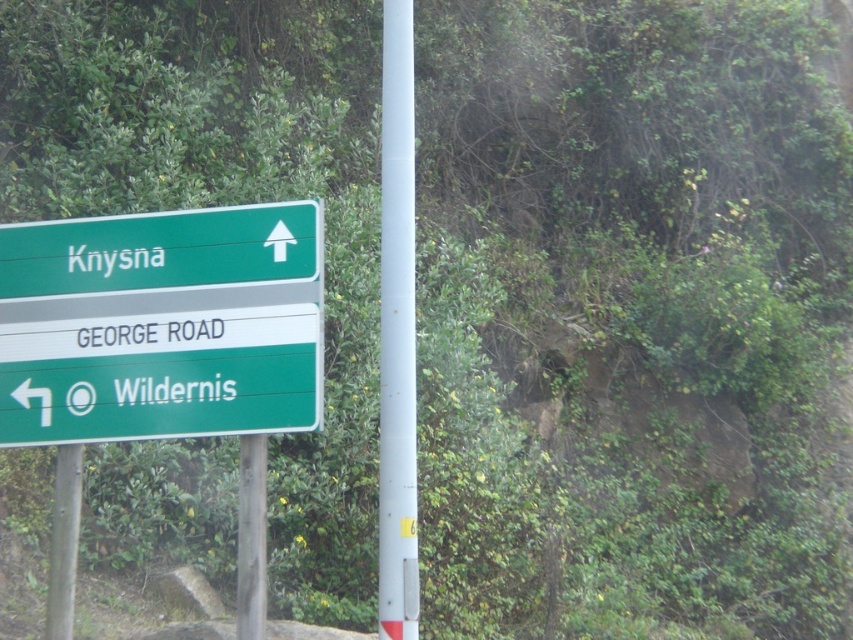
Which of these two, green plastic sign at upper center or white metallic pole at center, stands shorter?

green plastic sign at upper center

Does green plastic sign at upper center have a greater width compared to white metallic pole at center?

Yes, green plastic sign at upper center is wider than white metallic pole at center.

The width and height of the screenshot is (853, 640). What do you see at coordinates (161, 250) in the screenshot? I see `green plastic sign at upper center` at bounding box center [161, 250].

I want to click on green plastic sign at upper center, so click(161, 250).

Who is positioned more to the right, white metallic pole at center or metallic pole at center?

white metallic pole at center

How far apart are white metallic pole at center and metallic pole at center?

white metallic pole at center and metallic pole at center are 38.18 inches apart.

Identify the location of white metallic pole at center. The image size is (853, 640). (397, 333).

Where is `white metallic pole at center`? This screenshot has width=853, height=640. white metallic pole at center is located at coordinates (397, 333).

Who is taller, green plastic sign at upper center or metallic pole at center?

metallic pole at center

Identify the location of green plastic sign at upper center. (161, 250).